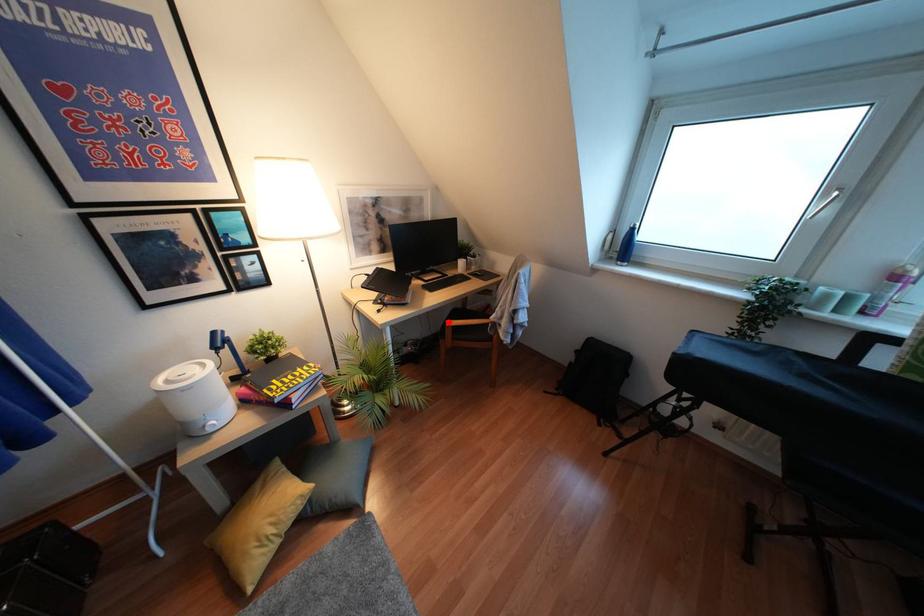
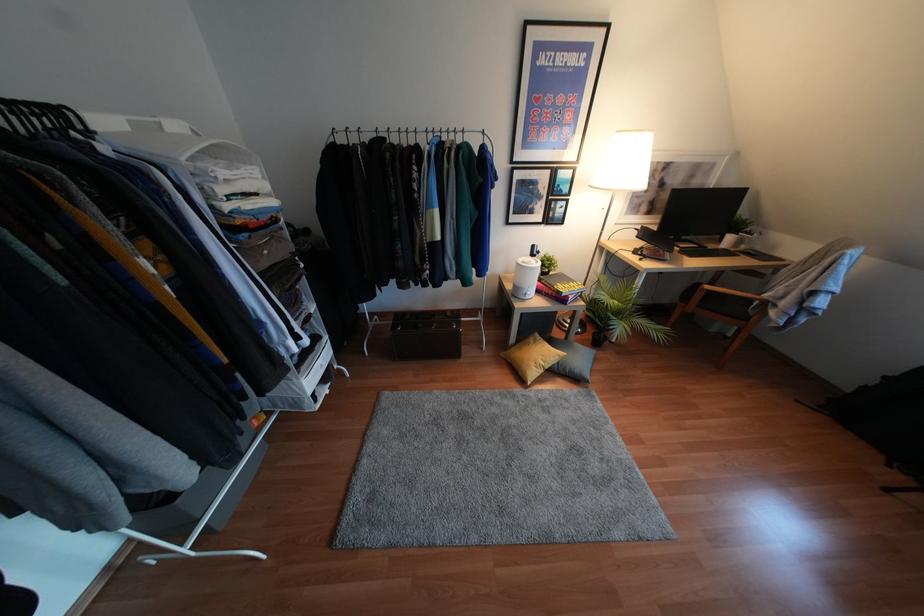
Question: I am providing you with two images of the same scene from different viewpoints. Given a red point in image1, look at the same physical point in image2. Is it:

Choices:
 (A) Closer to the viewpoint
 (B) Farther from the viewpoint

Answer: (A)